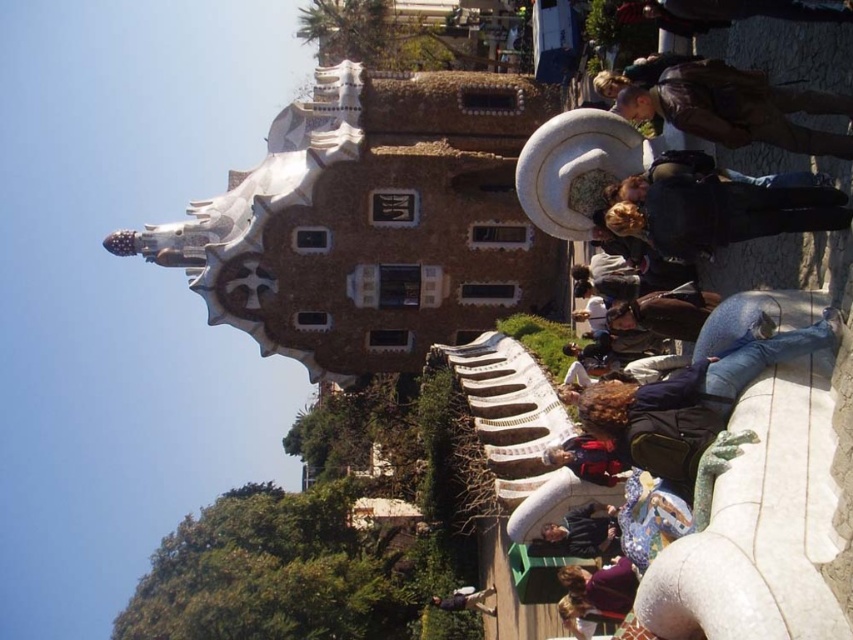
Is blue jeans at lower right below brown leather jacket at upper right?

Yes.

Between point (737, 388) and point (758, 134), which one is positioned behind?

The point (758, 134) is more distant.

I want to click on blue jeans at lower right, so click(x=693, y=404).

Measure the distance from brown leather jacket at upper right to purple matte shirt at lower center.

brown leather jacket at upper right and purple matte shirt at lower center are 25.14 meters apart from each other.

This screenshot has width=853, height=640. Identify the location of brown leather jacket at upper right. (732, 106).

Who is higher up, brown leather jacket at upper right or red fabric jacket at center?

brown leather jacket at upper right

Is brown leather jacket at upper right further to the viewer compared to red fabric jacket at center?

No, brown leather jacket at upper right is in front of red fabric jacket at center.

Who is more distant from viewer, (688, 60) or (550, 448)?

Positioned behind is point (550, 448).

Find the location of `brown leather jacket at upper right`. brown leather jacket at upper right is located at coordinates (732, 106).